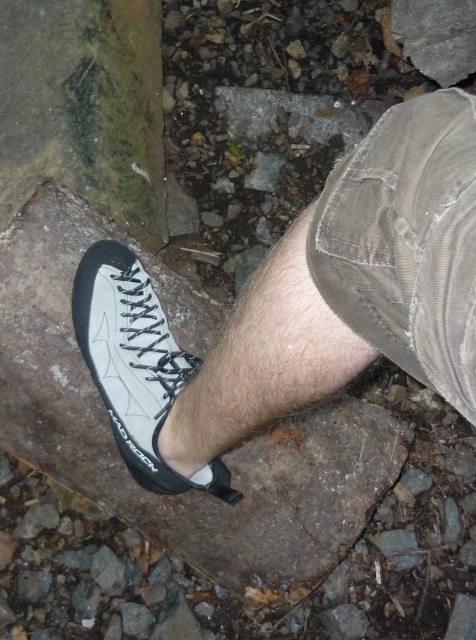
Looking at this image, you are a photographer trying to capture the white leather shoe at center and the smooth gray rock at center in a single shot. Since you want to focus on the shoe, which object should you ensure is closer to the camera?

The white leather shoe at center is in front of the smooth gray rock at center, so to focus on the shoe, ensure the white leather shoe at center is closer to the camera.

You are a hiker who wants to place both your hiking boots on the smooth gray rock at center and the white matte climbing shoe at center. Based on the size of the objects, can you fit both boots on the rock without overlapping?

The smooth gray rock at center has a larger size compared to the white matte climbing shoe at center, so it is possible to fit both boots on the smooth gray rock at center without overlapping.

You are a photographer trying to capture the exact spot where the person is standing. You need to place a marker at the point with coordinates point (303, 304). Based on the image, where should you place the marker?

The point (303, 304) is located on the white leather shoe at center, so you should place the marker on the white leather shoe at center.